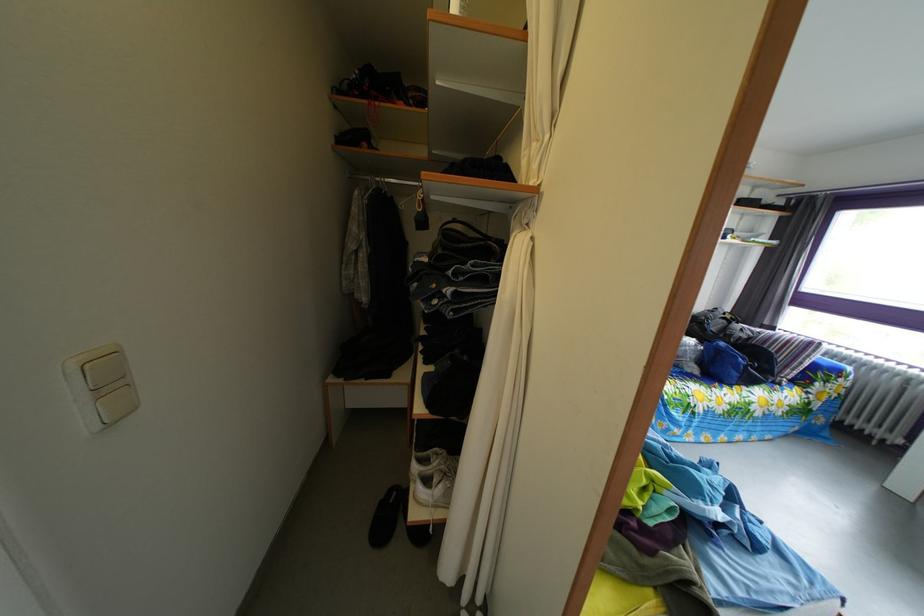
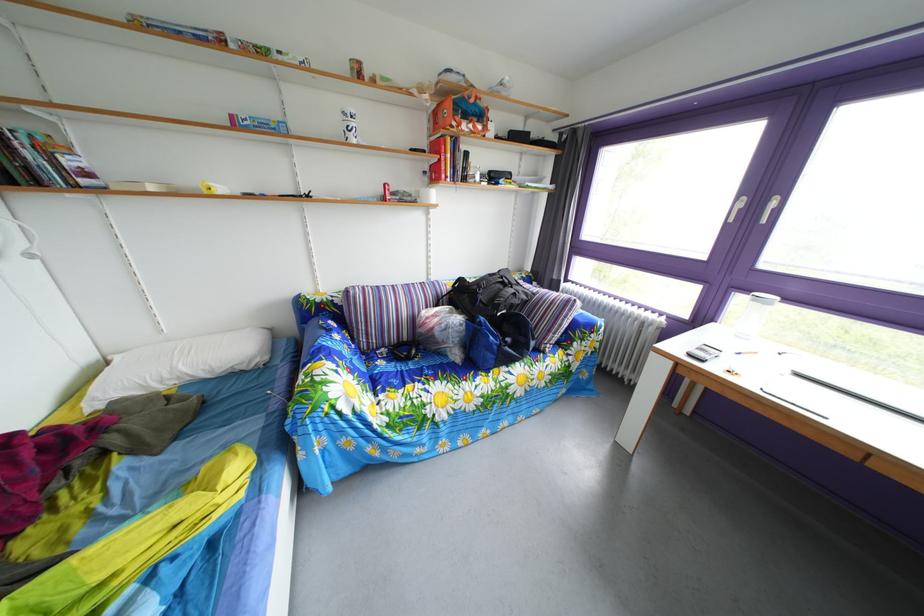
Question: The images are taken continuously from a first-person perspective. In which direction are you moving?

Choices:
 (A) Left
 (B) Right
 (C) Forward
 (D) Backward

Answer: (B)